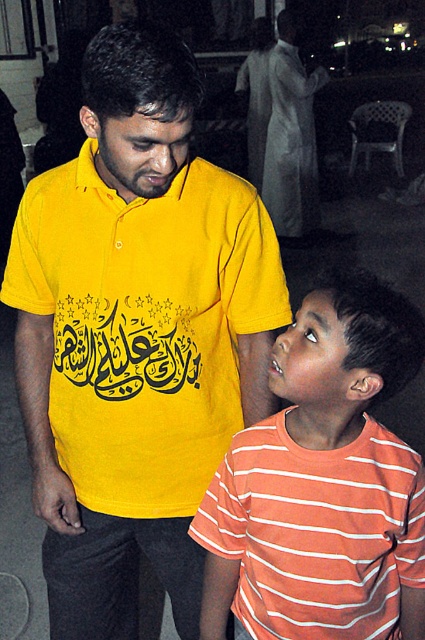
From the picture: You are a photographer adjusting your camera settings to focus on two points in an image. The first point is labeled as point (413, 582) and the second is point (300, 173). Given that you want to ensure both points are in focus, which point should you prioritize focusing on to achieve the best depth of field?

Point (413, 582) is closer to the camera than point (300, 173). To achieve the best depth of field, you should focus on the point that is closer to the camera, which is point (413, 582). This will ensure both points are within the depth of field range.

You are organizing a clothing store and need to arrange the matte yellow polo shirt at center and the matte yellow shirt at center on a rack. Since the rack has height restrictions, which one should you place on the lower hanger to ensure both fit properly?

The matte yellow polo shirt at center is not as tall as the matte yellow shirt at center, so place the shorter polo shirt on the lower hanger and the taller matte yellow shirt at center on the upper hanger to accommodate their sizes within the rack height limits.

You are a photographer trying to capture a clear shot of both the matte yellow polo shirt at center and the matte yellow shirt at center. Since the background is dimly lit, you want to ensure both subjects are in focus. Which of the two should you focus on first to ensure the closest one is sharp?

The matte yellow polo shirt at center is closer to the viewer than the matte yellow shirt at center, so you should focus on the matte yellow polo shirt at center first to ensure it is sharp before adjusting for the other.